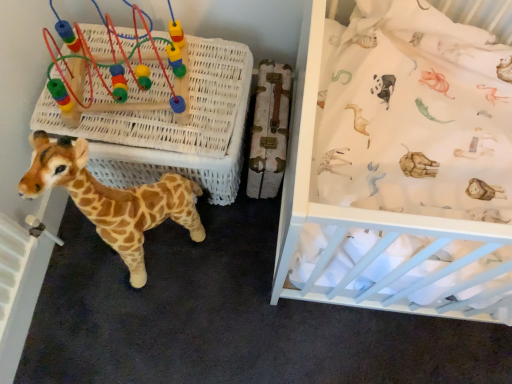
Identify the location of free point in front of soft plush giraffe at lower left. (141, 327).